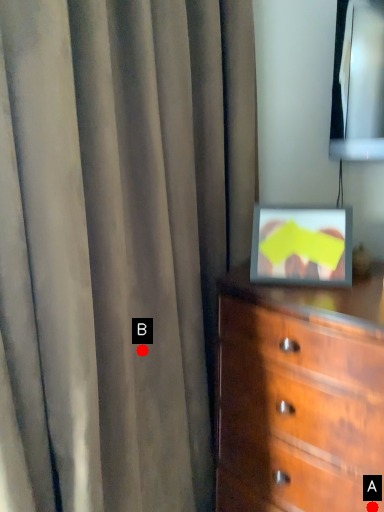
Question: Two points are circled on the image, labeled by A and B beside each circle. Which point appears farthest from the camera in this image?

Choices:
 (A) A is further
 (B) B is further

Answer: (B)